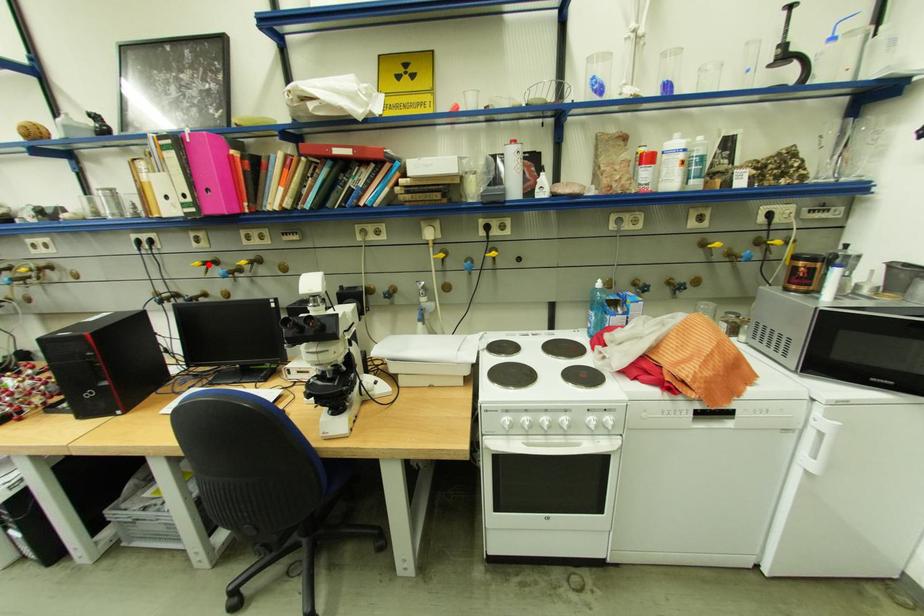
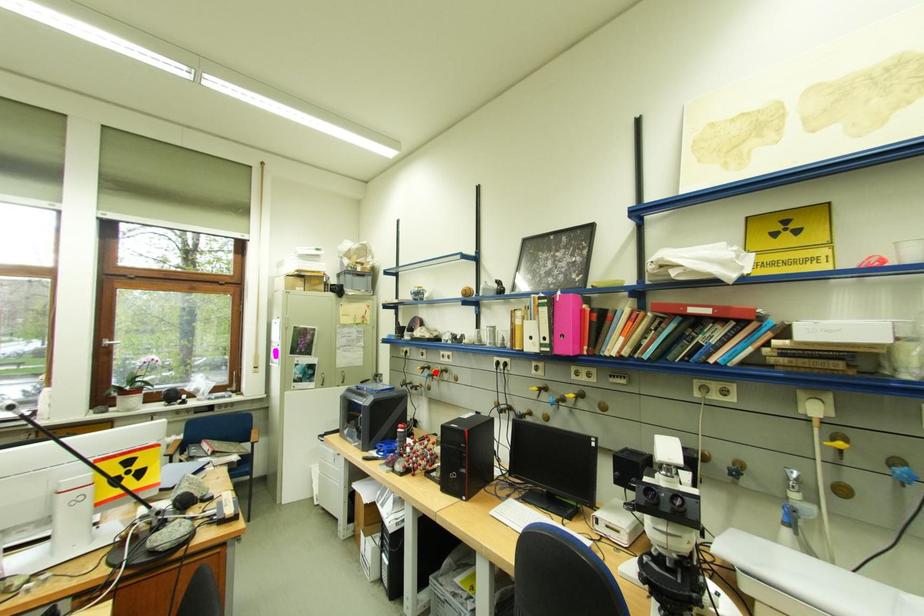
I am providing you with two images of the same scene from different viewpoints. A red point is marked on the first image and another point is marked on the second image. Is the red point in image1 aligned with the point shown in image2?

No